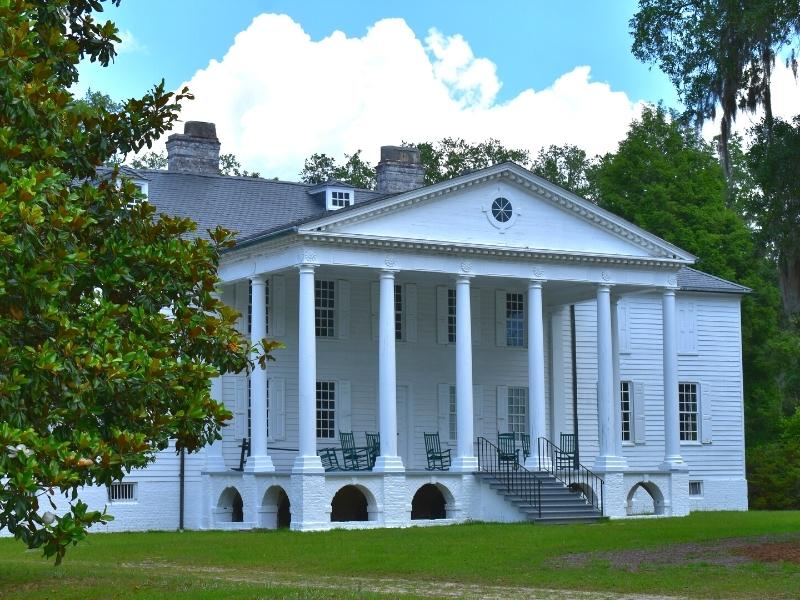
Identify the location of chimney. The height and width of the screenshot is (600, 800). 200,160.